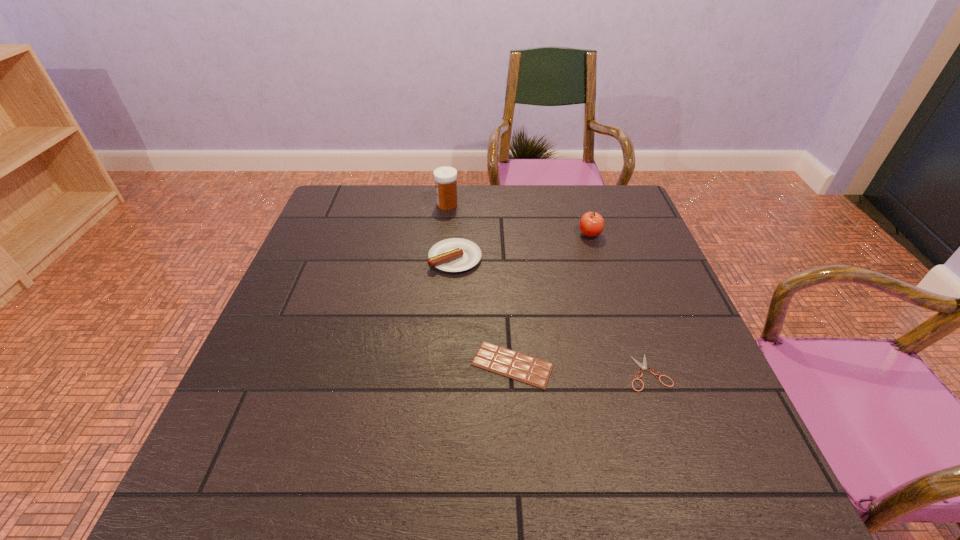
Locate an element on the screen. This screenshot has height=540, width=960. the closest object relative to the tallest object is located at coordinates (455, 254).

I want to click on the third closest object to the shortest object, so click(x=591, y=224).

Where is `free region that satisfies the following two spatial constraints: 1. on the front side of the second tallest object; 2. on the right side of the shears`? free region that satisfies the following two spatial constraints: 1. on the front side of the second tallest object; 2. on the right side of the shears is located at coordinates (633, 372).

Where is `vacant space that satisfies the following two spatial constraints: 1. on the back side of the sausage; 2. on the right side of the second farthest object`? The image size is (960, 540). vacant space that satisfies the following two spatial constraints: 1. on the back side of the sausage; 2. on the right side of the second farthest object is located at coordinates (457, 235).

The image size is (960, 540). What are the coordinates of `free space that satisfies the following two spatial constraints: 1. on the front side of the sausage; 2. on the left side of the chocolate bar` in the screenshot? It's located at (448, 364).